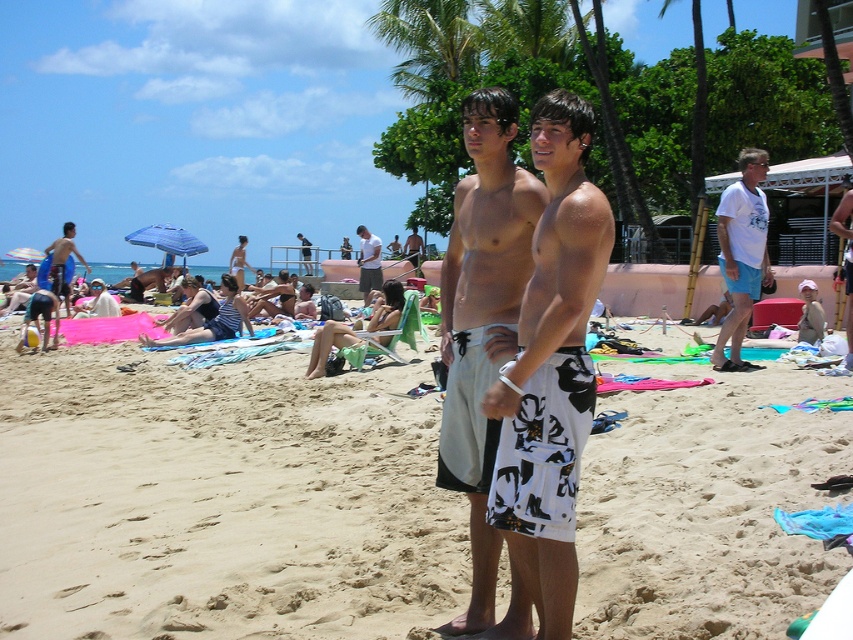
You are a photographer at the beach scene described. You want to capture a closeup shot of the white printed boardshorts at center. Based on their position, where should you aim your camera?

The white printed boardshorts at center are located at coordinates point (550, 368), so aim your camera towards that position to capture the closeup.